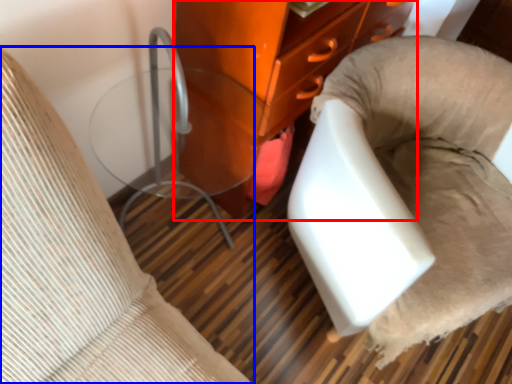
Question: Which object is closer to the camera taking this photo, furniture (highlighted by a red box) or furniture (highlighted by a blue box)?

Choices:
 (A) furniture
 (B) furniture

Answer: (B)